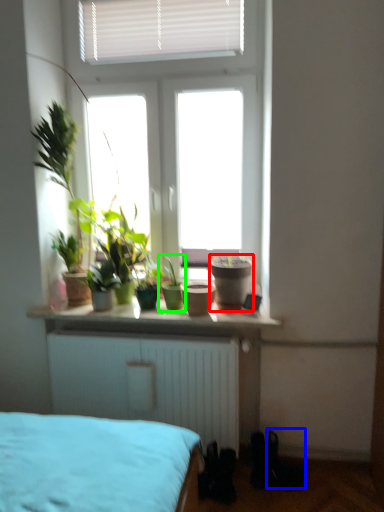
Question: Which object is positioned farthest from flowerpot (highlighted by a red box)? Select from shoe (highlighted by a blue box) and houseplant (highlighted by a green box).

Choices:
 (A) shoe
 (B) houseplant

Answer: (A)